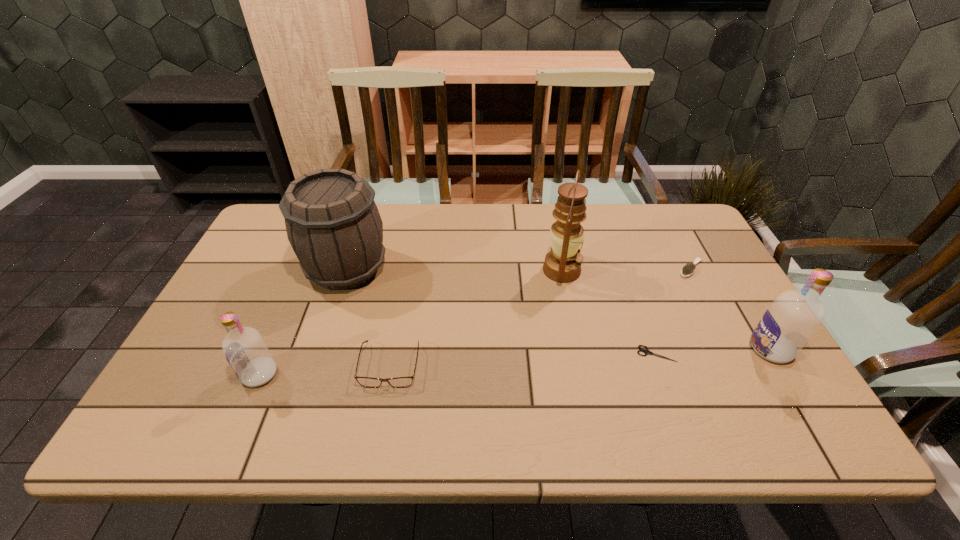
In the image, there is a desktop. Where is `free space at the near right corner`? This screenshot has width=960, height=540. free space at the near right corner is located at coordinates (779, 379).

Find the location of a particular element. The width and height of the screenshot is (960, 540). vacant space that is in between the scrubbing brush and the taller vodka is located at coordinates (731, 309).

In order to click on free space between the wine bucket and the taller vodka in this screenshot , I will do `click(559, 308)`.

I want to click on unoccupied position between the second shortest object and the shortest object, so click(674, 311).

Where is `vacant area between the fourth object from right to left and the third shortest object`? This screenshot has height=540, width=960. vacant area between the fourth object from right to left and the third shortest object is located at coordinates (476, 318).

Where is `vacant area that lies between the oil lamp and the shears`? The height and width of the screenshot is (540, 960). vacant area that lies between the oil lamp and the shears is located at coordinates (609, 312).

In order to click on free point between the wine bucket and the fourth object from right to left in this screenshot , I will do `click(454, 269)`.

The width and height of the screenshot is (960, 540). Find the location of `unoccupied position between the shorter vodka and the second shortest object`. unoccupied position between the shorter vodka and the second shortest object is located at coordinates (475, 321).

Identify the location of empty space between the wine bucket and the spectacles. This screenshot has height=540, width=960. (369, 316).

This screenshot has width=960, height=540. I want to click on vacant space that's between the wine bucket and the left vodka, so click(303, 321).